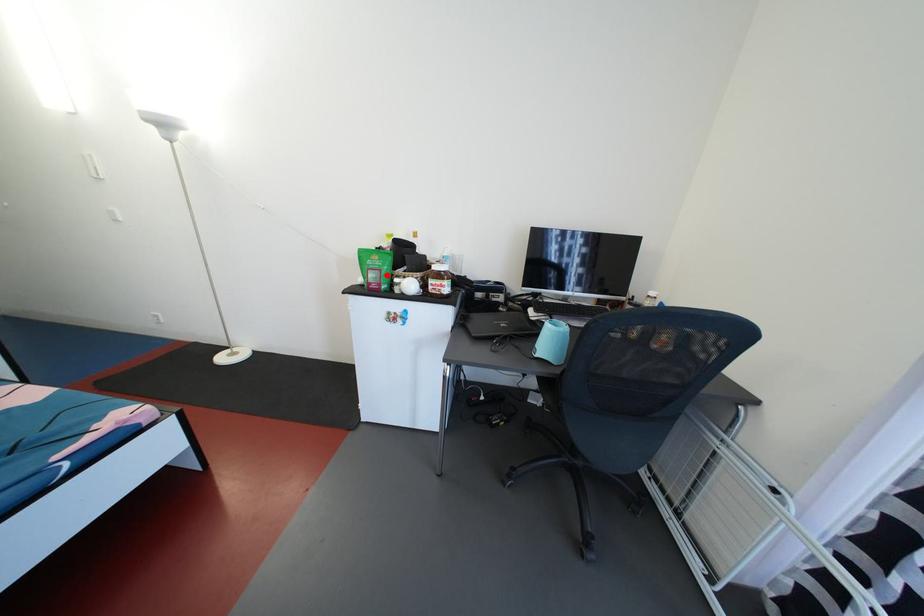
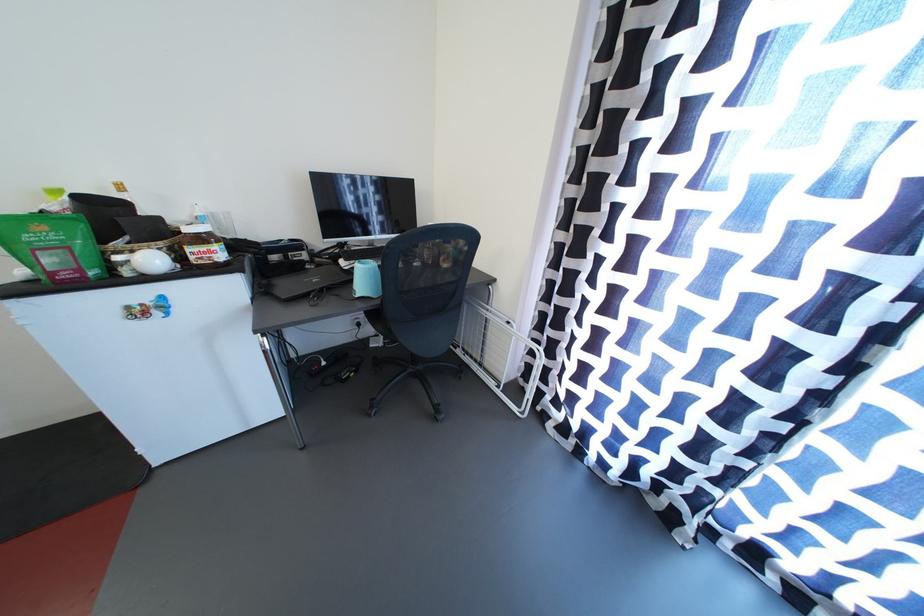
Locate, in the second image, the point that corresponds to the highlighted location in the first image.

(75, 253)